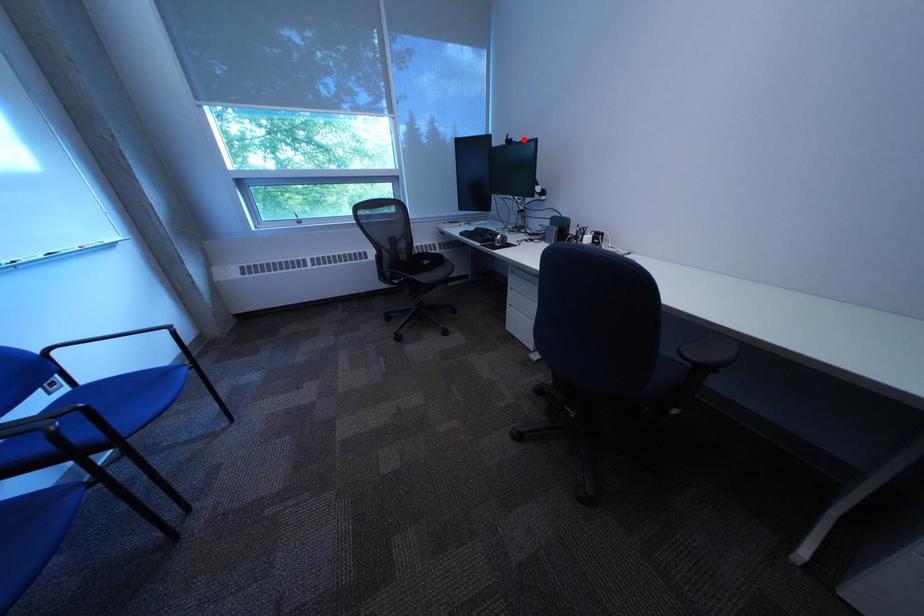
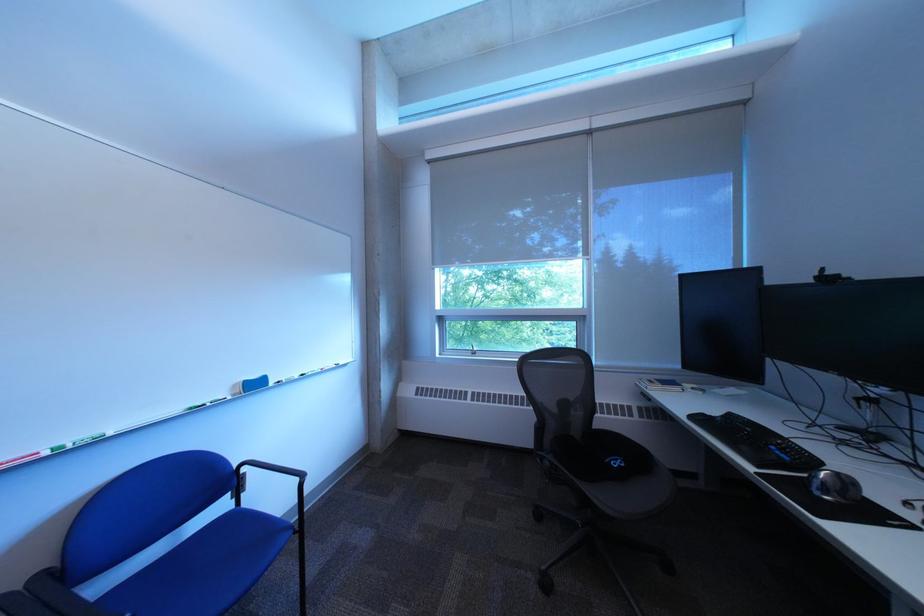
Question: I am providing you with two images of the same scene from different viewpoints. A red point is shown in image1. For the corresponding object point in image2, is it positioned nearer or farther from the camera?

Choices:
 (A) Nearer
 (B) Farther

Answer: (B)